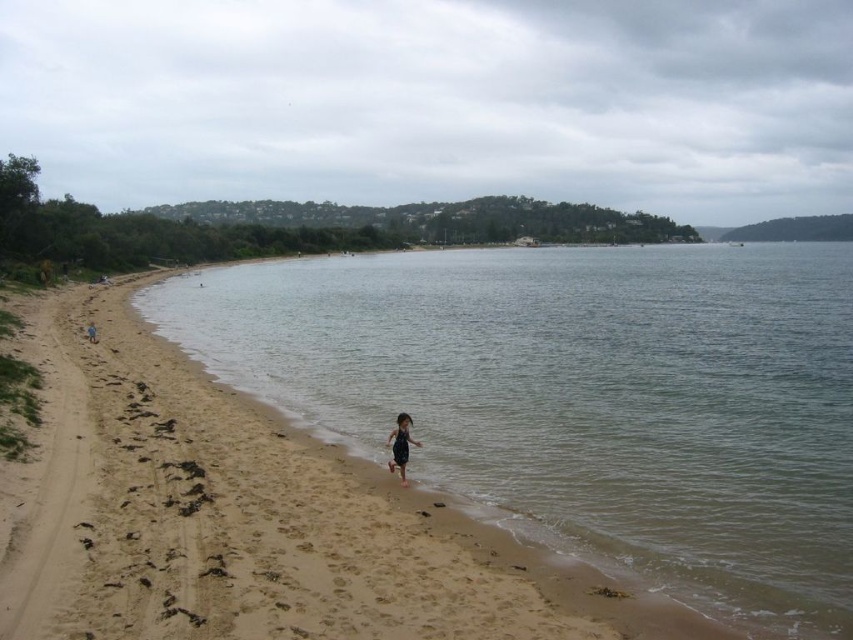
Question: Which of the following is the farthest from the observer?

Choices:
 (A) clear water at center
 (B) dark blue swimsuit at center
 (C) dark blue swimsuit at lower left

Answer: (C)

Question: Where is dark blue swimsuit at center located in relation to dark blue swimsuit at lower left in the image?

Choices:
 (A) above
 (B) below

Answer: (B)

Question: Does clear water at center appear on the left side of dark blue swimsuit at center?

Choices:
 (A) yes
 (B) no

Answer: (A)

Question: Can you confirm if clear water at center is positioned above dark blue swimsuit at lower left?

Choices:
 (A) yes
 (B) no

Answer: (A)

Question: Which object is positioned closest to the dark blue swimsuit at center?

Choices:
 (A) dark blue swimsuit at lower left
 (B) clear water at center

Answer: (A)

Question: Considering the real-world distances, which object is closest to the dark blue swimsuit at center?

Choices:
 (A) dark blue swimsuit at lower left
 (B) clear water at center

Answer: (A)